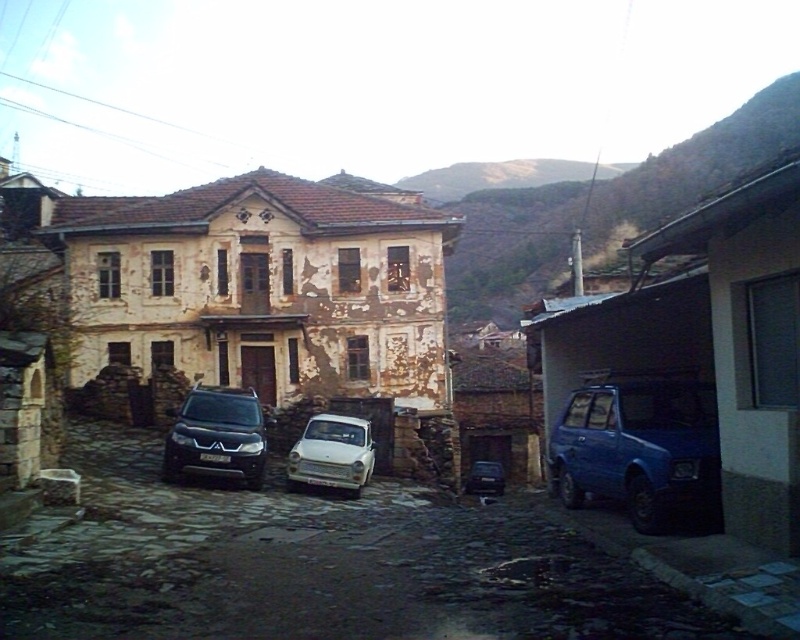
You are a delivery person needing to drive a truck that is 2 meters wide through the smooth stone alley at center. There is also a white matte car at center parked there. Can you pass through the alley without hitting the car?

The smooth stone alley at center might be wider than white matte car at center, so there is a possibility that the alley is wide enough for the 2m wide truck to pass through without hitting the car.

You are standing at the center of the cobblestone street in front of the old building. You see two points marked on the ground. One is at point coordinates point (200,445) and the other is at point coordinates point (354,486). Which of these two points is closer to you?

Point (200,445) is in front of point (354,486), so it is closer to you.